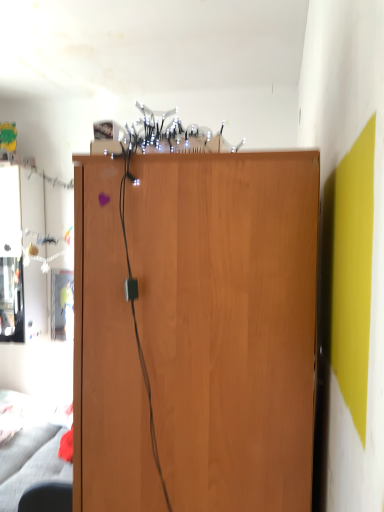
Question: Is black leather swivel chair at lower left in front of or behind wooden cupboard at center in the image?

Choices:
 (A) front
 (B) behind

Answer: (B)

Question: Considering the positions of black leather swivel chair at lower left and wooden cupboard at center in the image, is black leather swivel chair at lower left bigger or smaller than wooden cupboard at center?

Choices:
 (A) big
 (B) small

Answer: (B)

Question: In terms of width, does black leather swivel chair at lower left look wider or thinner when compared to wooden cupboard at center?

Choices:
 (A) wide
 (B) thin

Answer: (B)

Question: In terms of height, does wooden cupboard at center look taller or shorter compared to black leather swivel chair at lower left?

Choices:
 (A) tall
 (B) short

Answer: (A)

Question: From the image's perspective, is wooden cupboard at center located above or below black leather swivel chair at lower left?

Choices:
 (A) above
 (B) below

Answer: (A)

Question: In the image, is wooden cupboard at center positioned in front of or behind black leather swivel chair at lower left?

Choices:
 (A) front
 (B) behind

Answer: (A)

Question: Visually, is wooden cupboard at center positioned to the left or to the right of black leather swivel chair at lower left?

Choices:
 (A) right
 (B) left

Answer: (A)